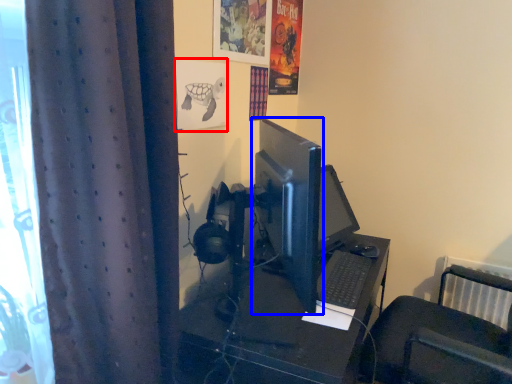
Question: Which of the following is the closest to the observer, poster page (highlighted by a red box) or computer monitor (highlighted by a blue box)?

Choices:
 (A) poster page
 (B) computer monitor

Answer: (A)